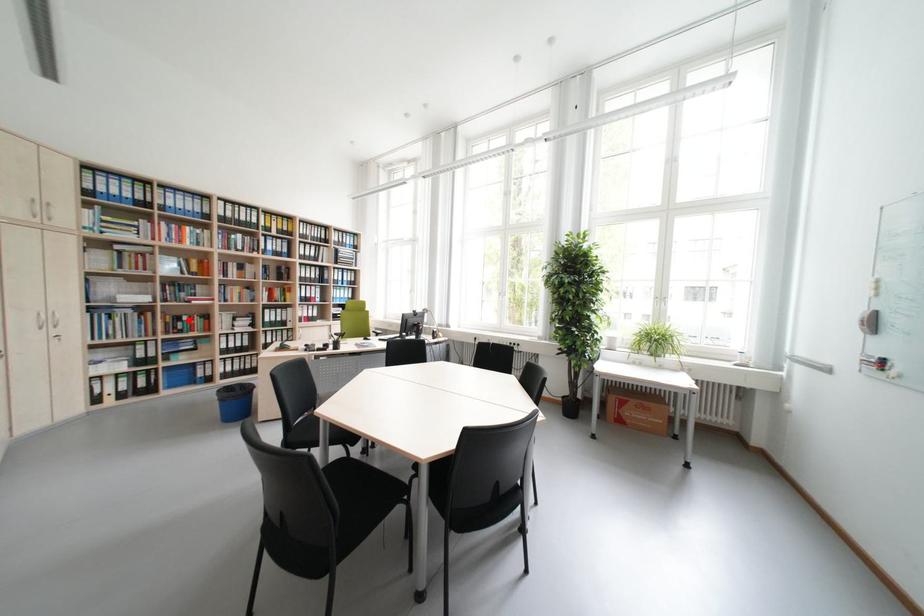
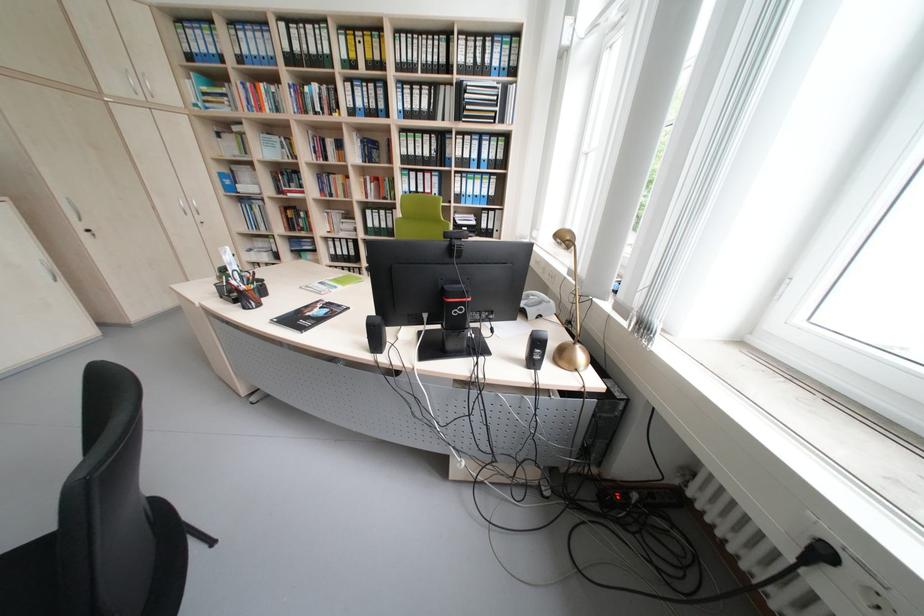
Question: A red point is marked in image1. In image2, is the corresponding 3D point closer to the camera or farther? Reply with the corresponding letter.

Choices:
 (A) The corresponding 3D point is closer.
 (B) The corresponding 3D point is farther.

Answer: (A)